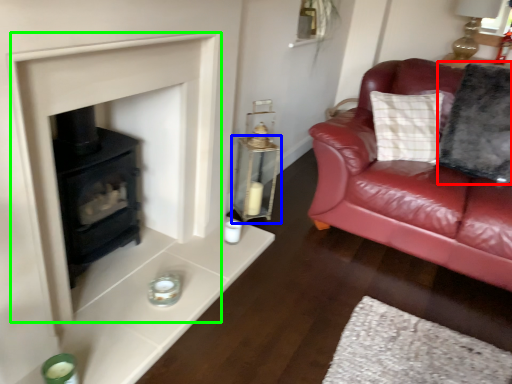
Question: Estimate the real-world distances between objects in this image. Which object is farther from pillow (highlighted by a red box), table (highlighted by a blue box) or fireplace (highlighted by a green box)?

Choices:
 (A) table
 (B) fireplace

Answer: (B)